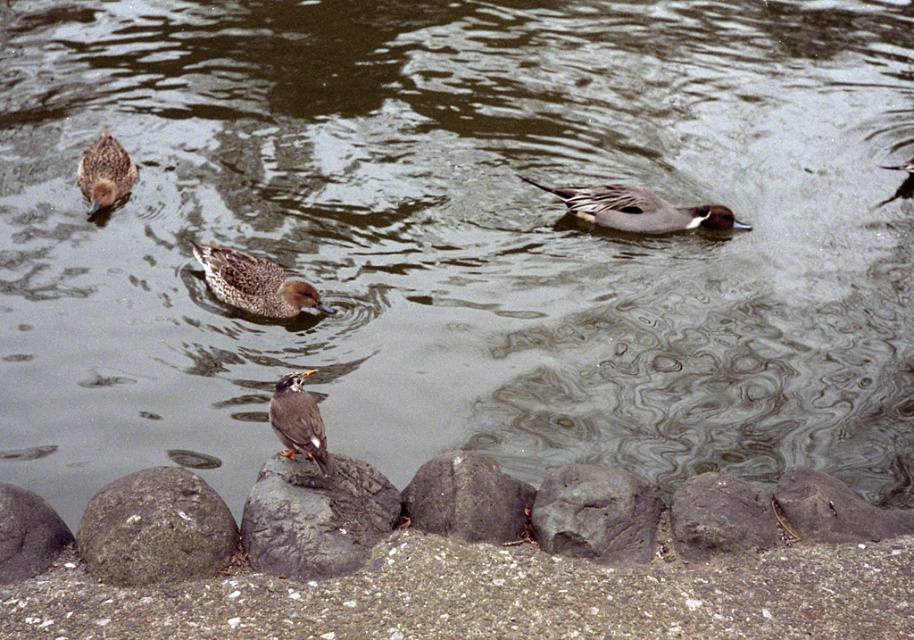
Question: Which object is the farthest from the smooth gray rock at lower right?

Choices:
 (A) smooth gray rock at center
 (B) speckled feathered duck at center
 (C) rough gray rock at lower left

Answer: (B)

Question: Based on their relative distances, which object is farther from the smooth gray rock at lower left?

Choices:
 (A) dark gray rock at center
 (B) speckled feathered duck at center
 (C) gray rough rock at center
 (D) rough gray rock at lower left

Answer: (B)

Question: Is dark gray rock at center smaller than smooth gray rock at lower right?

Choices:
 (A) no
 (B) yes

Answer: (A)

Question: Which of the following is the closest to the observer?

Choices:
 (A) (410, 499)
 (B) (808, 515)
 (C) (583, 193)
 (D) (222, 262)

Answer: (B)

Question: Does gray rough rock at lower right appear on the left side of speckled feathered duck at center?

Choices:
 (A) yes
 (B) no

Answer: (B)

Question: Is gray rough rock at center wider than smooth gray rock at lower right?

Choices:
 (A) yes
 (B) no

Answer: (B)